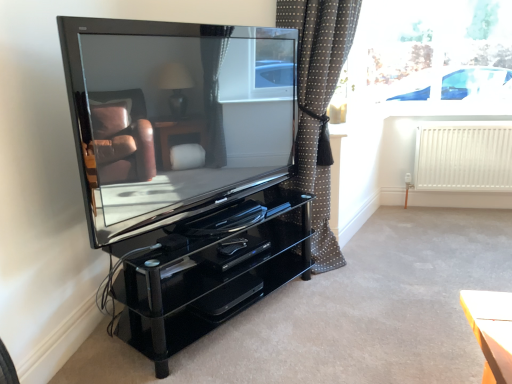
Identify the location of vacant space situated on the left part of white matte radiator at right. (410, 221).